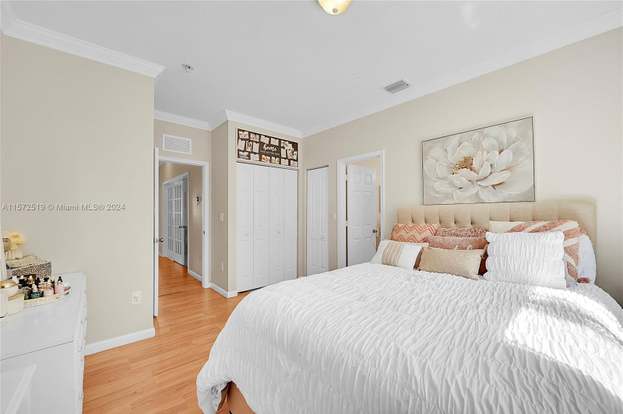
Where is `pillows on bed`? pillows on bed is located at coordinates (400, 253), (405, 234), (445, 253), (445, 242), (447, 235), (587, 254), (574, 236), (543, 261).